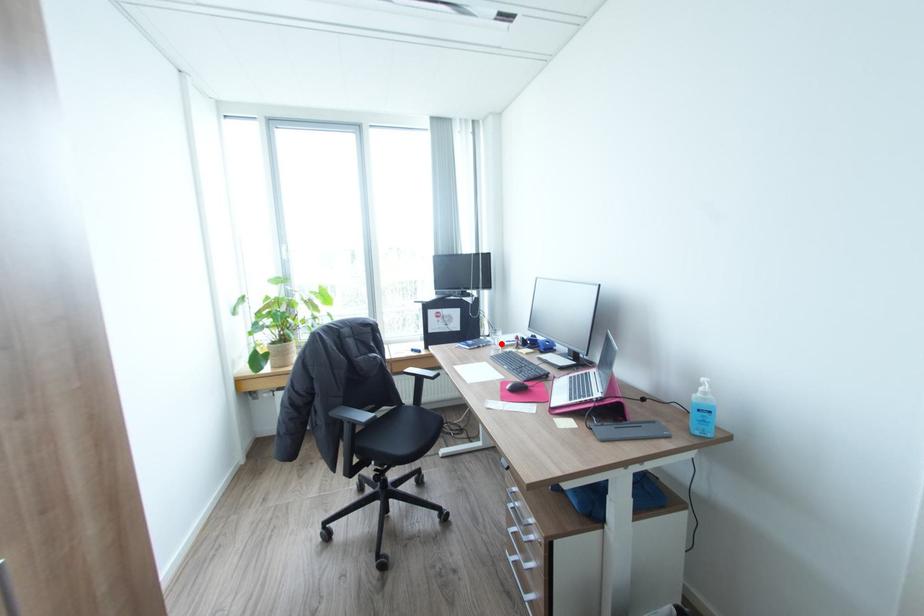
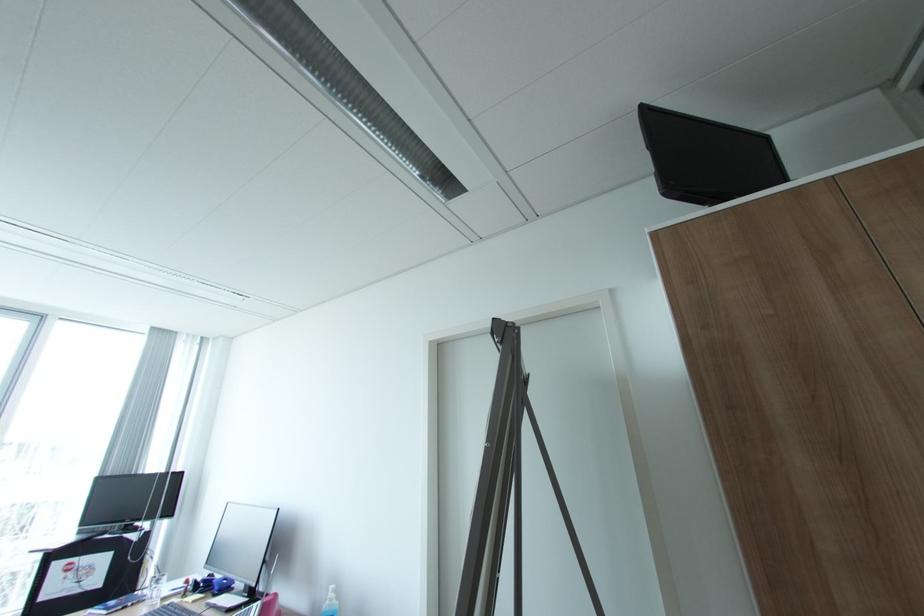
Question: I am providing you with two images of the same scene from different viewpoints. A red point is shown in image1. For the corresponding object point in image2, is it positioned nearer or farther from the camera?

Choices:
 (A) Nearer
 (B) Farther

Answer: (A)